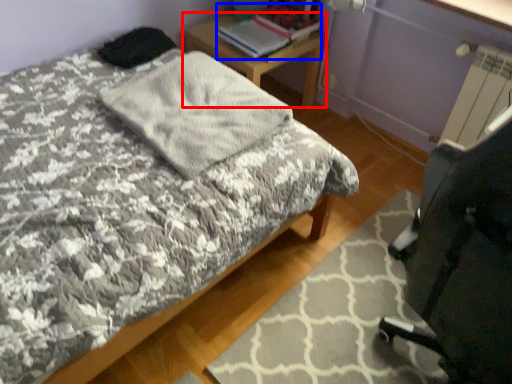
Question: Which point is further to the camera, desk (highlighted by a red box) or book (highlighted by a blue box)?

Choices:
 (A) desk
 (B) book

Answer: (A)